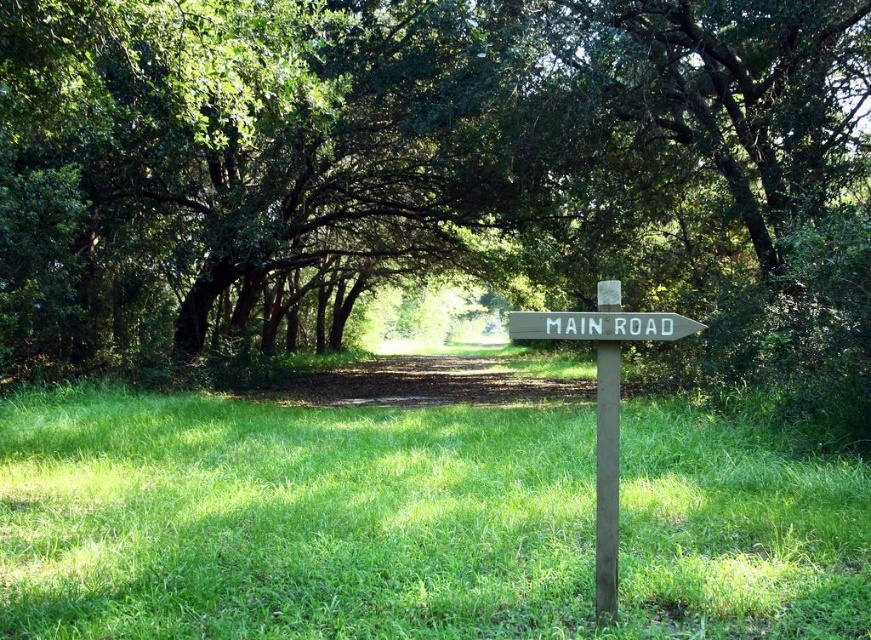
You are planning to place a new bench in the green grassy field at center and the wooden signpost at center. Since the bench requires a space of 1.2 meters in length, can both objects accommodate the bench without overlapping?

The green grassy field at center has a smaller size compared to wooden signpost at center, but the description does not provide specific measurements for either object. Therefore, it is unclear if the bench can be placed without overlapping. More information about their dimensions is needed.